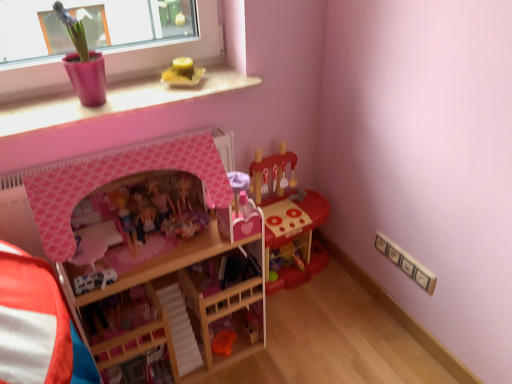
What are the coordinates of `free location above pink plastic window sill at upper left (from a real-world perspective)` in the screenshot? It's located at (138, 97).